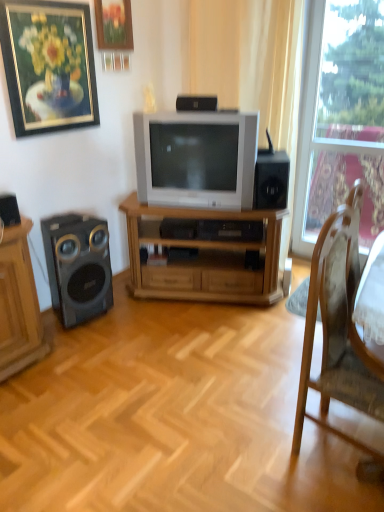
Question: In terms of size, does matte silver television at center appear bigger or smaller than gold-framed painting at upper left, marked as the second picture frame in a right-to-left arrangement?

Choices:
 (A) big
 (B) small

Answer: (A)

Question: Do you think matte silver television at center is within gold-framed painting at upper left, the 1th picture frame from the left, or outside of it?

Choices:
 (A) inside
 (B) outside

Answer: (B)

Question: Which object is the farthest from the transparent glass window at right?

Choices:
 (A) wooden chair at right
 (B) wooden tv stand at center
 (C) wooden picture frame at upper center, marked as the first picture frame in a right-to-left arrangement
 (D) matte black speaker at left
 (E) black matte speaker at upper center, acting as the 1th speaker starting from the top

Answer: (A)

Question: Considering the real-world distances, which object is closest to the transparent glass window at right?

Choices:
 (A) matte silver television at center
 (B) wooden tv stand at center
 (C) black matte speaker at left, which is counted as the third speaker, starting from the top
 (D) wooden chair at right
 (E) wooden picture frame at upper center, marked as the first picture frame in a right-to-left arrangement

Answer: (B)